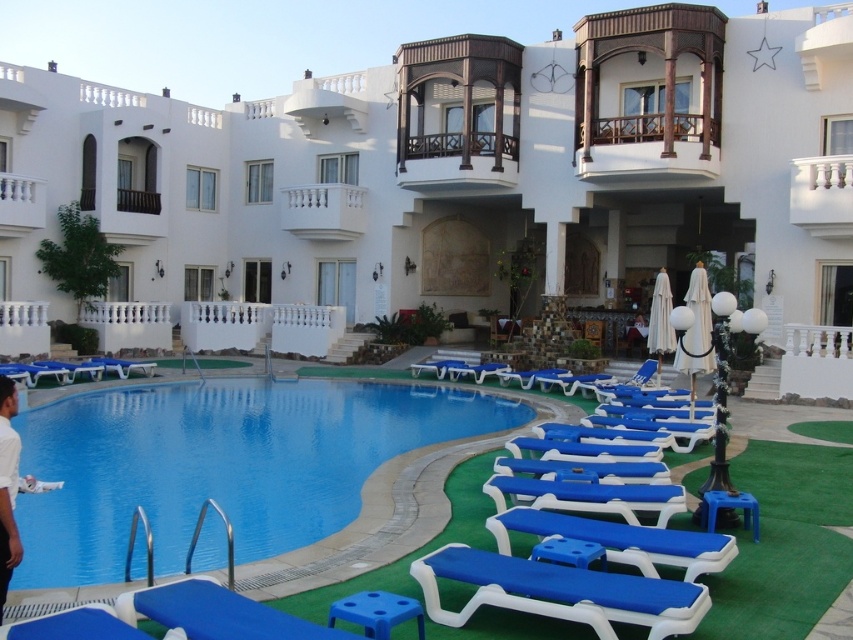
Question: Among these points, which one is farthest from the camera?

Choices:
 (A) (494, 524)
 (B) (699, 248)
 (C) (361, 387)

Answer: (B)

Question: Where is blue plastic lounge chairs at lower center located in relation to blue plastic chair at lower center in the image?

Choices:
 (A) below
 (B) above

Answer: (B)

Question: Which point is closer to the camera?

Choices:
 (A) (378, 250)
 (B) (672, 625)

Answer: (B)

Question: Which of the following is the closest to the observer?

Choices:
 (A) blue plastic lounge chairs at lower center
 (B) blue plastic pool at center
 (C) blue plastic chair at center

Answer: (B)

Question: Is blue plastic pool at center above blue plastic chair at center?

Choices:
 (A) no
 (B) yes

Answer: (A)

Question: Can you confirm if blue plastic chair at lower center is positioned above blue plastic chair at center?

Choices:
 (A) yes
 (B) no

Answer: (B)